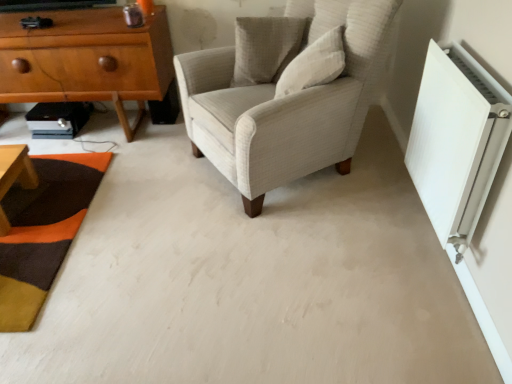
What do you see at coordinates (265, 47) in the screenshot?
I see `textured beige pillow at upper center, the 2th pillow positioned from the front` at bounding box center [265, 47].

Locate an element on the screen. The height and width of the screenshot is (384, 512). white plastic radiator at right is located at coordinates (456, 141).

You are a GUI agent. You are given a task and a screenshot of the screen. Output one action in this format:
    pyautogui.click(x=<x>, y=<y>)
    Task: Click on the white cotton pillow at upper center, the first pillow when ordered from front to back
    
    Given the screenshot: What is the action you would take?
    pyautogui.click(x=314, y=64)

Is white plastic radiator at right to the left of light beige fabric armchair at center from the viewer's perspective?

In fact, white plastic radiator at right is to the right of light beige fabric armchair at center.

Is white plastic radiator at right oriented towards light beige fabric armchair at center?

No, white plastic radiator at right is not turned towards light beige fabric armchair at center.

From a real-world perspective, is white plastic radiator at right over light beige fabric armchair at center?

No, from a real-world perspective, white plastic radiator at right is not over light beige fabric armchair at center

Is point (430, 46) positioned in front of point (198, 66)?

Yes.

From the image's perspective, which is above, textured wool mat at lower left or light brown wood chest of drawers at left?

light brown wood chest of drawers at left appears higher in the image.

Is textured wool mat at lower left bigger or smaller than light brown wood chest of drawers at left?

textured wool mat at lower left is smaller than light brown wood chest of drawers at left.

Is textured wool mat at lower left further to the viewer compared to light brown wood chest of drawers at left?

No, textured wool mat at lower left is in front of light brown wood chest of drawers at left.

Is textured wool mat at lower left aimed at light brown wood chest of drawers at left?

No.

From the picture: Measure the distance from textured beige pillow at upper center, the 2th pillow positioned from the front, to white plastic radiator at right.

A distance of 36.44 inches exists between textured beige pillow at upper center, the 2th pillow positioned from the front, and white plastic radiator at right.

From the image's perspective, would you say textured beige pillow at upper center, the 2th pillow positioned from the front, is positioned over white plastic radiator at right?

Yes, from the image's perspective, textured beige pillow at upper center, the 2th pillow positioned from the front, is over white plastic radiator at right.

Which of these two, textured beige pillow at upper center, the 2th pillow positioned from the front, or white plastic radiator at right, stands shorter?

textured beige pillow at upper center, the 2th pillow positioned from the front.

The height and width of the screenshot is (384, 512). What are the coordinates of `the 2nd pillow above when counting from the white plastic radiator at right (from the image's perspective)` in the screenshot? It's located at (265, 47).

Consider the image. Is light brown wood chest of drawers at left located outside textured beige pillow at upper center, positioned as the first pillow in back-to-front order?

Yes, light brown wood chest of drawers at left is located beyond the bounds of textured beige pillow at upper center, positioned as the first pillow in back-to-front order.

Can you see light brown wood chest of drawers at left touching textured beige pillow at upper center, positioned as the first pillow in back-to-front order?

They are not placed beside each other.

What are the coordinates of `the 1st pillow located above the light brown wood chest of drawers at left (from a real-world perspective)` in the screenshot? It's located at (265, 47).

From a real-world perspective, who is located lower, light brown wood chest of drawers at left or textured beige pillow at upper center, the 2th pillow positioned from the front?

light brown wood chest of drawers at left.

Is white cotton pillow at upper center, the first pillow when ordered from front to back, to the right of light beige fabric armchair at center from the viewer's perspective?

Yes, white cotton pillow at upper center, the first pillow when ordered from front to back, is to the right of light beige fabric armchair at center.

Which object is more forward, white cotton pillow at upper center, the first pillow when ordered from front to back, or light beige fabric armchair at center?

light beige fabric armchair at center.

From the image's perspective, which is above, white cotton pillow at upper center, the first pillow when ordered from front to back, or light beige fabric armchair at center?

From the image's view, white cotton pillow at upper center, the first pillow when ordered from front to back, is above.

From a real-world perspective, is textured beige pillow at upper center, the 2th pillow positioned from the front, beneath textured wool mat at lower left?

Incorrect, from a real-world perspective, textured beige pillow at upper center, the 2th pillow positioned from the front, is higher than textured wool mat at lower left.

Considering the sizes of objects textured beige pillow at upper center, positioned as the first pillow in back-to-front order, and textured wool mat at lower left in the image provided, who is taller, textured beige pillow at upper center, positioned as the first pillow in back-to-front order, or textured wool mat at lower left?

Standing taller between the two is textured beige pillow at upper center, positioned as the first pillow in back-to-front order.

Is textured beige pillow at upper center, positioned as the first pillow in back-to-front order, oriented towards textured wool mat at lower left?

No, textured beige pillow at upper center, positioned as the first pillow in back-to-front order, is not aimed at textured wool mat at lower left.

Is point (265, 17) closer to camera compared to point (42, 235)?

No, (265, 17) is further to viewer.

Is white cotton pillow at upper center, the first pillow when ordered from front to back, thinner than textured beige pillow at upper center, positioned as the first pillow in back-to-front order?

No, white cotton pillow at upper center, the first pillow when ordered from front to back, is not thinner than textured beige pillow at upper center, positioned as the first pillow in back-to-front order.

Considering the relative sizes of white cotton pillow at upper center, the second pillow positioned from the back, and textured beige pillow at upper center, the 2th pillow positioned from the front, in the image provided, is white cotton pillow at upper center, the second pillow positioned from the back, taller than textured beige pillow at upper center, the 2th pillow positioned from the front,?

In fact, white cotton pillow at upper center, the second pillow positioned from the back, may be shorter than textured beige pillow at upper center, the 2th pillow positioned from the front.

From the image's perspective, is white cotton pillow at upper center, the second pillow positioned from the back, located above textured beige pillow at upper center, the 2th pillow positioned from the front?

No.

Looking at this image, can you tell me how much white cotton pillow at upper center, the second pillow positioned from the back, and textured beige pillow at upper center, the 2th pillow positioned from the front, differ in facing direction?

They differ by 112 degrees in their facing directions.

Where is `air conditioning on the right of the light beige fabric armchair at center`? air conditioning on the right of the light beige fabric armchair at center is located at coordinates (456, 141).

There is a textured wool mat at lower left. Where is `the chest of drawers above it (from a real-world perspective)`? the chest of drawers above it (from a real-world perspective) is located at coordinates (89, 61).

Estimate the real-world distances between objects in this image. Which object is further from white plastic radiator at right, textured beige pillow at upper center, the 2th pillow positioned from the front, or light brown wood chest of drawers at left?

light brown wood chest of drawers at left lies further to white plastic radiator at right than the other object.

Considering their positions, is light beige fabric armchair at center positioned further to white plastic radiator at right than textured wool mat at lower left?

The object further to white plastic radiator at right is textured wool mat at lower left.

From the picture: Estimate the real-world distances between objects in this image. Which object is closer to light beige fabric armchair at center, textured wool mat at lower left or white plastic radiator at right?

white plastic radiator at right lies closer to light beige fabric armchair at center than the other object.

When comparing their distances from textured beige pillow at upper center, positioned as the first pillow in back-to-front order, does white plastic radiator at right or textured wool mat at lower left seem closer?

white plastic radiator at right lies closer to textured beige pillow at upper center, positioned as the first pillow in back-to-front order, than the other object.

In the scene shown: Which object lies further to the anchor point textured beige pillow at upper center, positioned as the first pillow in back-to-front order, light brown wood chest of drawers at left or textured wool mat at lower left?

textured wool mat at lower left.

Considering their positions, is textured wool mat at lower left positioned closer to light brown wood chest of drawers at left than light beige fabric armchair at center?

The object closer to light brown wood chest of drawers at left is textured wool mat at lower left.

When comparing their distances from textured wool mat at lower left, does light brown wood chest of drawers at left or white cotton pillow at upper center, the first pillow when ordered from front to back, seem closer?

light brown wood chest of drawers at left is closer to textured wool mat at lower left.

In the scene shown: Based on their spatial positions, is textured beige pillow at upper center, positioned as the first pillow in back-to-front order, or textured wool mat at lower left further from light brown wood chest of drawers at left?

Among the two, textured beige pillow at upper center, positioned as the first pillow in back-to-front order, is located further to light brown wood chest of drawers at left.

Where is `mat situated between light brown wood chest of drawers at left and light beige fabric armchair at center from left to right`? Image resolution: width=512 pixels, height=384 pixels. mat situated between light brown wood chest of drawers at left and light beige fabric armchair at center from left to right is located at coordinates (42, 231).

Find the location of a particular element. Image resolution: width=512 pixels, height=384 pixels. chair located between white plastic radiator at right and textured beige pillow at upper center, positioned as the first pillow in back-to-front order, in the depth direction is located at coordinates (286, 92).

Locate an element on the screen. The image size is (512, 384). mat between light brown wood chest of drawers at left and white cotton pillow at upper center, the first pillow when ordered from front to back, in the horizontal direction is located at coordinates (42, 231).

Locate an element on the screen. This screenshot has width=512, height=384. mat situated between light brown wood chest of drawers at left and white plastic radiator at right from left to right is located at coordinates (42, 231).